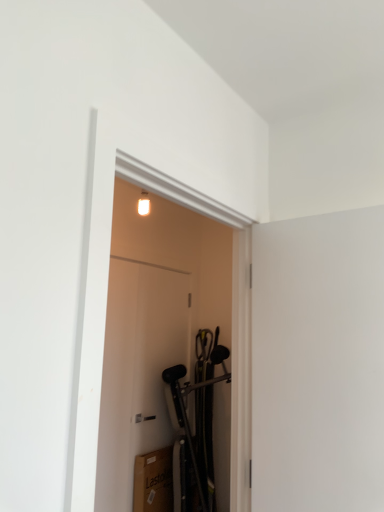
Identify the location of white matte door at center, which is the second door in front-to-back order. (137, 371).

What is the approximate width of white matte screen door at right?

white matte screen door at right is 3.47 inches wide.

Where is `white matte door at center, which is the second door in front-to-back order`? This screenshot has width=384, height=512. white matte door at center, which is the second door in front-to-back order is located at coordinates (137, 371).

Would you say white matte door at center, which is the second door in front-to-back order, is part of white glossy door at center, which is the first door from front to back,'s contents?

No, white matte door at center, which is the second door in front-to-back order, is not surrounded by white glossy door at center, which is the first door from front to back.

Is white glossy door at center, which is the first door from front to back, beside white matte door at center, which is the second door in front-to-back order?

Yes, the surface of white glossy door at center, which is the first door from front to back, is in contact with white matte door at center, which is the second door in front-to-back order.

In the image, is white glossy door at center, acting as the second door starting from the back, positioned in front of or behind white matte door at center, which is counted as the 1th door, starting from the back?

white glossy door at center, acting as the second door starting from the back, is positioned closer to the viewer than white matte door at center, which is counted as the 1th door, starting from the back.

In the image, there is a white matte door at center, which is the second door in front-to-back order. In order to click on door above it (from the image's perspective) in this screenshot , I will do `click(154, 324)`.

From the image's perspective, would you say white matte door at center, which is the second door in front-to-back order, is positioned over white glossy door at center, which is the first door from front to back?

Result: Actually, white matte door at center, which is the second door in front-to-back order, appears below white glossy door at center, which is the first door from front to back, in the image.

Is white matte door at center, which is counted as the 1th door, starting from the back, facing away from white glossy door at center, which is the first door from front to back?

white matte door at center, which is counted as the 1th door, starting from the back, is not turned away from white glossy door at center, which is the first door from front to back.

Which is more to the right, white matte door at center, which is counted as the 1th door, starting from the back, or white glossy door at center, which is the first door from front to back?

white glossy door at center, which is the first door from front to back, is more to the right.

Does white matte door at center, which is counted as the 1th door, starting from the back, have a larger size compared to white glossy door at center, which is the first door from front to back?

No, white matte door at center, which is counted as the 1th door, starting from the back, is not bigger than white glossy door at center, which is the first door from front to back.

Is white glossy door at center, which is the first door from front to back, inside the boundaries of white matte screen door at right, or outside?

white glossy door at center, which is the first door from front to back, is spatially situated outside white matte screen door at right.

Is white glossy door at center, which is the first door from front to back, facing away from white matte screen door at right?

That's right, white glossy door at center, which is the first door from front to back, is facing away from white matte screen door at right.

This screenshot has height=512, width=384. I want to click on door lying above the white matte screen door at right (from the image's perspective), so click(154, 324).

Which point is more distant from viewer, (108, 301) or (333, 493)?

The point (108, 301) is more distant.

Would you consider white matte screen door at right to be distant from white matte door at center, which is counted as the 1th door, starting from the back?

Yes, white matte screen door at right and white matte door at center, which is counted as the 1th door, starting from the back, are located far from each other.

Considering the relative positions of white matte screen door at right and white matte door at center, which is counted as the 1th door, starting from the back, in the image provided, is white matte screen door at right to the left of white matte door at center, which is counted as the 1th door, starting from the back, from the viewer's perspective?

In fact, white matte screen door at right is to the right of white matte door at center, which is counted as the 1th door, starting from the back.

Which of these two, white matte screen door at right or white matte door at center, which is the second door in front-to-back order, stands shorter?

With less height is white matte screen door at right.

Can you confirm if white matte screen door at right is positioned to the left of white glossy door at center, which is the first door from front to back?

No.

From the image's perspective, is white matte screen door at right on white glossy door at center, acting as the second door starting from the back?

No, from the image's perspective, white matte screen door at right is not over white glossy door at center, acting as the second door starting from the back.

Is white matte screen door at right facing towards white glossy door at center, which is the first door from front to back?

Yes, white matte screen door at right is turned towards white glossy door at center, which is the first door from front to back.

Is point (378, 404) positioned in front of point (159, 251)?

Yes, it is in front of point (159, 251).

Identify the location of door that is below the white matte screen door at right (from the image's perspective). The height and width of the screenshot is (512, 384). (137, 371).

From a real-world perspective, is white matte door at center, which is counted as the 1th door, starting from the back, physically located above or below white matte screen door at right?

Clearly, from a real-world perspective, white matte door at center, which is counted as the 1th door, starting from the back, is below white matte screen door at right.

Is white matte door at center, which is counted as the 1th door, starting from the back, positioned far away from white matte screen door at right?

Indeed, white matte door at center, which is counted as the 1th door, starting from the back, is not near white matte screen door at right.

Between white matte door at center, which is the second door in front-to-back order, and white matte screen door at right, which one is positioned in front?

white matte screen door at right is in front.

The height and width of the screenshot is (512, 384). What are the coordinates of `door below the white glossy door at center, which is the first door from front to back (from a real-world perspective)` in the screenshot? It's located at (137, 371).

Where is `door on the right side of white matte door at center, which is the second door in front-to-back order`? This screenshot has height=512, width=384. door on the right side of white matte door at center, which is the second door in front-to-back order is located at coordinates (154, 324).

Based on their spatial positions, is white glossy door at center, acting as the second door starting from the back, or white matte screen door at right closer to white matte door at center, which is counted as the 1th door, starting from the back?

Among the two, white glossy door at center, acting as the second door starting from the back, is located nearer to white matte door at center, which is counted as the 1th door, starting from the back.

Considering their positions, is white matte door at center, which is the second door in front-to-back order, positioned closer to white glossy door at center, which is the first door from front to back, than white matte screen door at right?

Based on the image, white matte door at center, which is the second door in front-to-back order, appears to be nearer to white glossy door at center, which is the first door from front to back.

Estimate the real-world distances between objects in this image. Which object is closer to white matte screen door at right, white matte door at center, which is counted as the 1th door, starting from the back, or white glossy door at center, which is the first door from front to back?

white matte door at center, which is counted as the 1th door, starting from the back, is positioned closer to the anchor white matte screen door at right.

Estimate the real-world distances between objects in this image. Which object is closer to white glossy door at center, which is the first door from front to back, white matte screen door at right or white matte door at center, which is counted as the 1th door, starting from the back?

Among the two, white matte door at center, which is counted as the 1th door, starting from the back, is located nearer to white glossy door at center, which is the first door from front to back.

From the picture: Which object lies further to the anchor point white matte door at center, which is counted as the 1th door, starting from the back, white matte screen door at right or white glossy door at center, acting as the second door starting from the back?

The object further to white matte door at center, which is counted as the 1th door, starting from the back, is white matte screen door at right.

From the picture: Considering their positions, is white glossy door at center, acting as the second door starting from the back, positioned further to white matte screen door at right than white matte door at center, which is the second door in front-to-back order?

The object further to white matte screen door at right is white glossy door at center, acting as the second door starting from the back.

The image size is (384, 512). I want to click on screen door between white glossy door at center, acting as the second door starting from the back, and white matte door at center, which is counted as the 1th door, starting from the back, along the z-axis, so click(x=318, y=362).